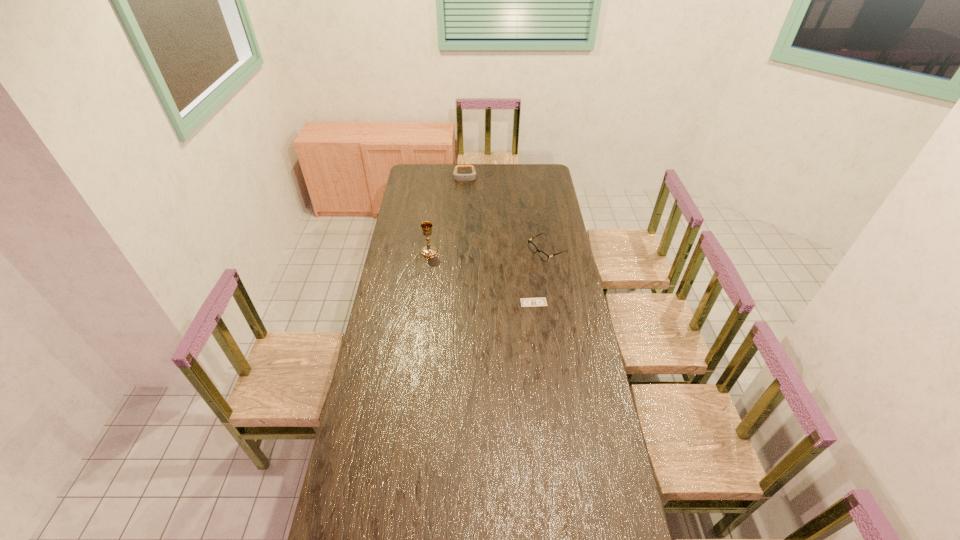
At what (x,y) coordinates should I click in order to perform the action: click on vacant space at the left edge of the desktop. Please return your answer as a coordinate pair (x, y). Looking at the image, I should click on (357, 398).

Locate an element on the screen. The height and width of the screenshot is (540, 960). vacant space at the right edge of the desktop is located at coordinates (567, 370).

The width and height of the screenshot is (960, 540). I want to click on free spot at the far left corner of the desktop, so click(x=415, y=166).

You are a GUI agent. You are given a task and a screenshot of the screen. Output one action in this format:
    pyautogui.click(x=<x>, y=<y>)
    Task: Click on the vacant region at the near left corner of the desktop
    Image resolution: width=960 pixels, height=540 pixels.
    Given the screenshot: What is the action you would take?
    pyautogui.click(x=337, y=505)

Where is `vacant area between the chalice and the spectacles`? This screenshot has height=540, width=960. vacant area between the chalice and the spectacles is located at coordinates (488, 252).

The image size is (960, 540). In order to click on vacant point located between the money and the chalice in this screenshot , I will do `click(481, 278)`.

In order to click on unoccupied position between the leftmost object and the nearest object in this screenshot , I will do `click(481, 278)`.

Locate an element on the screen. Image resolution: width=960 pixels, height=540 pixels. vacant region between the chalice and the spectacles is located at coordinates (488, 252).

This screenshot has height=540, width=960. What are the coordinates of `empty location between the spectacles and the nearest object` in the screenshot? It's located at (540, 276).

This screenshot has width=960, height=540. Identify the location of vacant space that's between the nearest object and the spectacles. (540, 276).